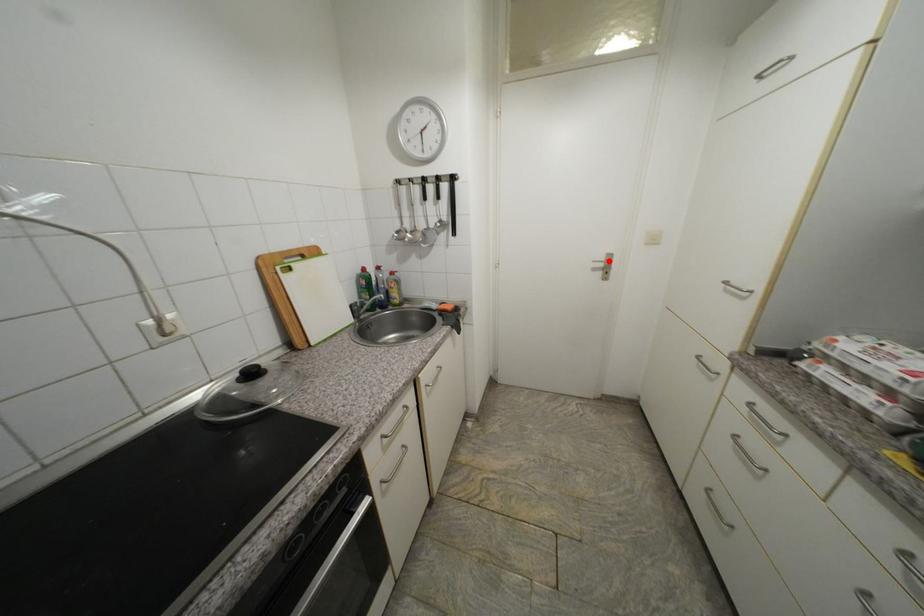
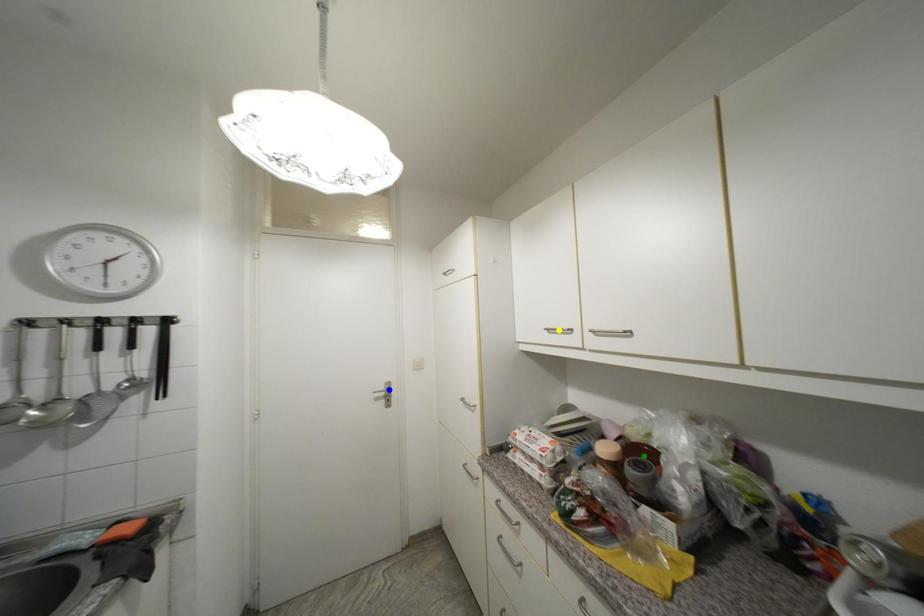
Question: I am providing you with two images of the same scene from different viewpoints. A red point is marked on the first image. You are given multiple points on the second image. Can you choose the point in image 2 that corresponds to the point in image 1?

Choices:
 (A) yellow point
 (B) green point
 (C) blue point

Answer: (C)